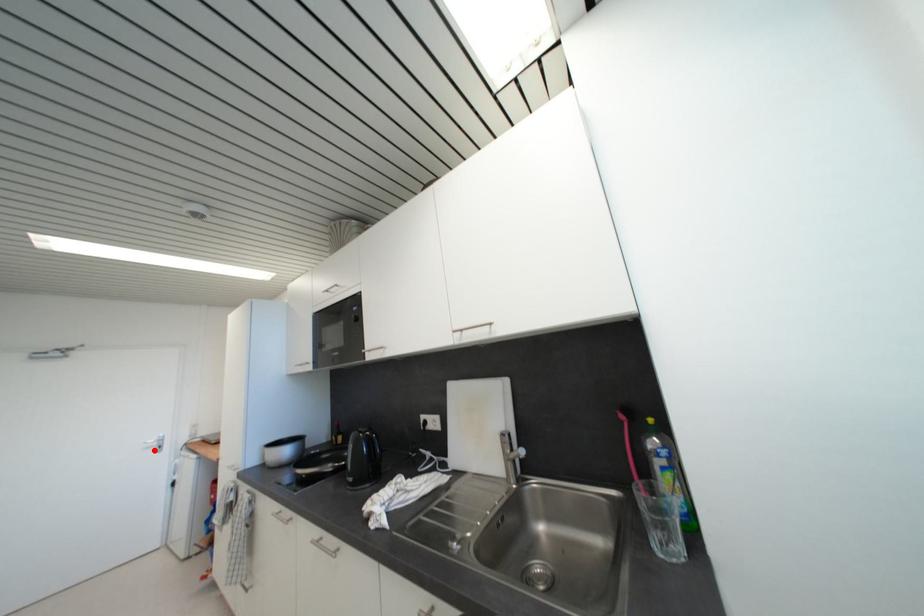
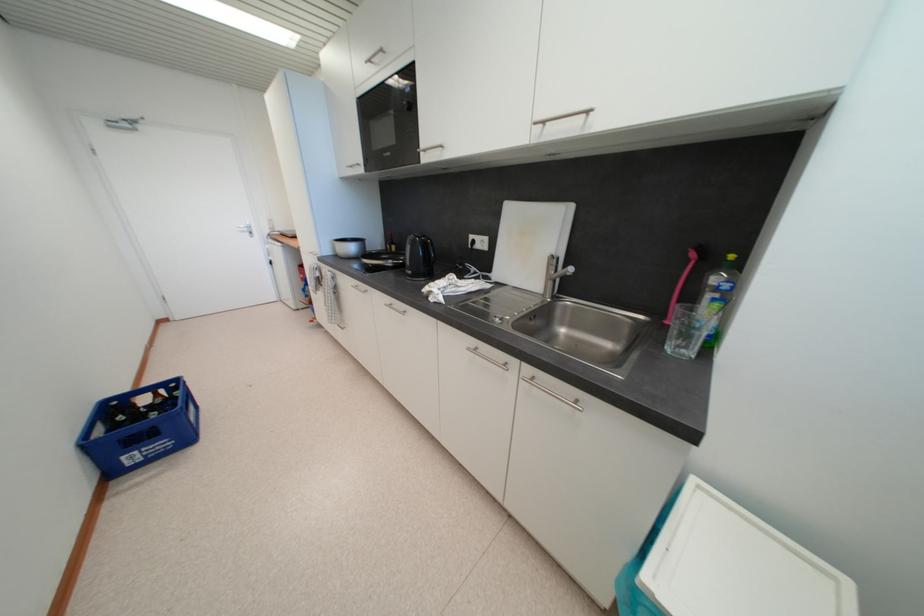
Question: I am providing you with two images of the same scene from different viewpoints. A red point is shown in image1. For the corresponding object point in image2, is it positioned nearer or farther from the camera?

Choices:
 (A) Nearer
 (B) Farther

Answer: (A)